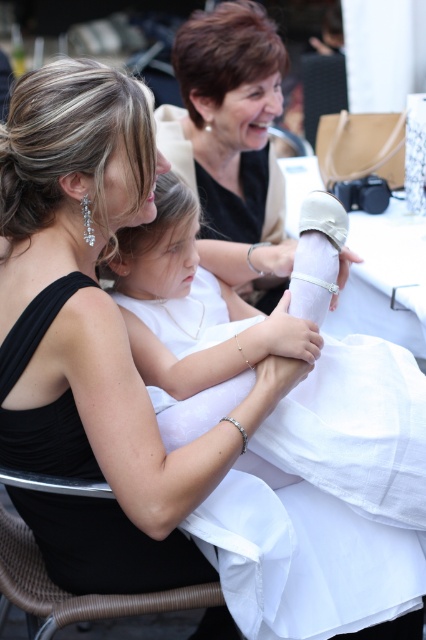
You are a photographer at the event and need to adjust the lighting to ensure both the matte black dress at upper center and the white satin dress at center are visible. Considering their sizes, which dress might require more light to be properly exposed?

The matte black dress at upper center has a larger size compared to white satin dress at center, so it might require more light to ensure proper exposure since larger objects can sometimes need more illumination to capture details effectively.

You are a photographer at the event and need to adjust the lighting so that the matte black dress at upper center and the white satin tablecloth at center are both well lit. Given their height difference, which object should you focus the light on first?

The matte black dress at upper center is much taller than the white satin tablecloth at center, so you should focus the light on the matte black dress at upper center first to ensure it is properly illuminated.

You are a photographer at a wedding reception. You need to position a bouquet between the white satin dress at center and the white satin tablecloth at center. According to the scene, which side of the tablecloth should the bouquet be placed to ensure it aligns with the dress?

The white satin dress at center is to the left of white satin tablecloth at center, so the bouquet should be placed to the left side of the tablecloth to align with the dress.